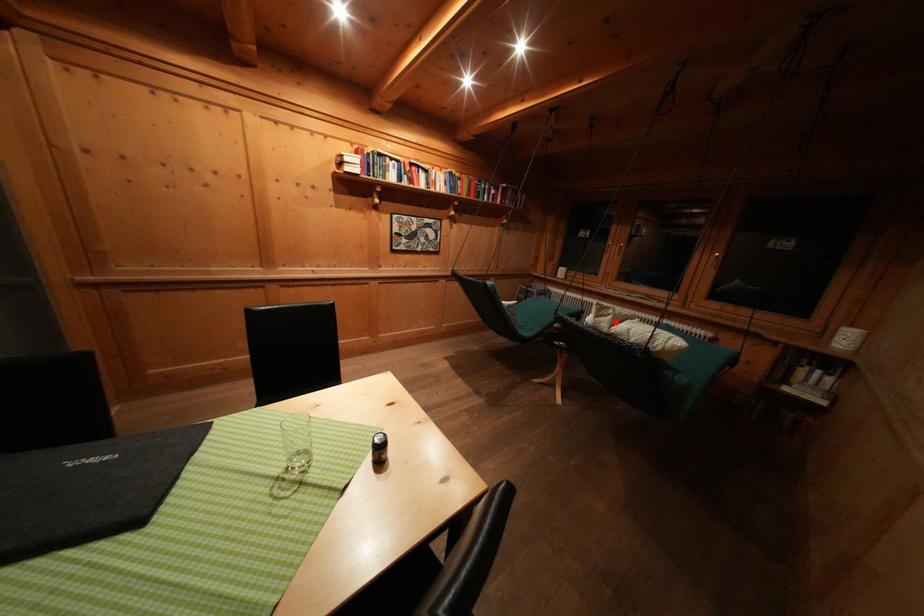
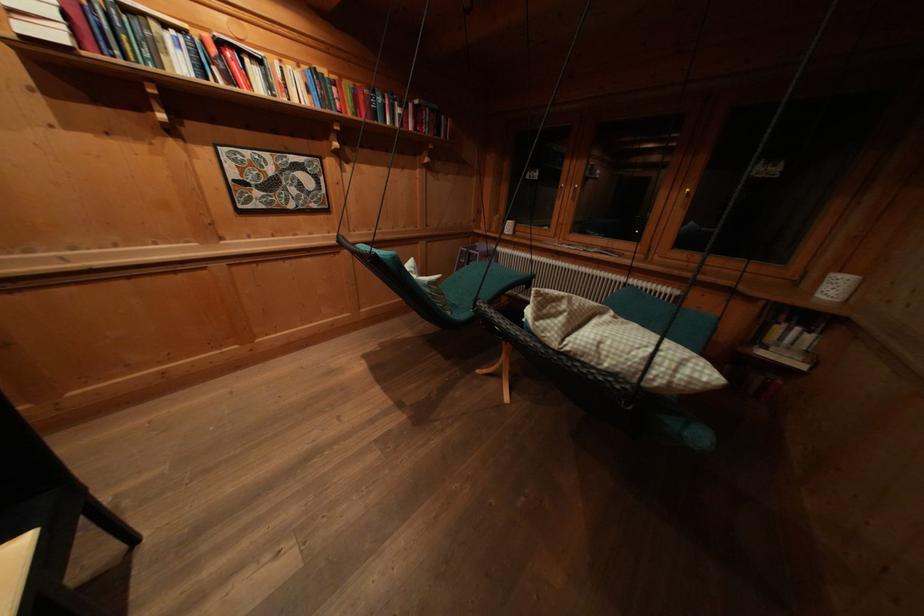
Where in the second image is the point corresponding to the highlighted location from the first image?

(567, 323)